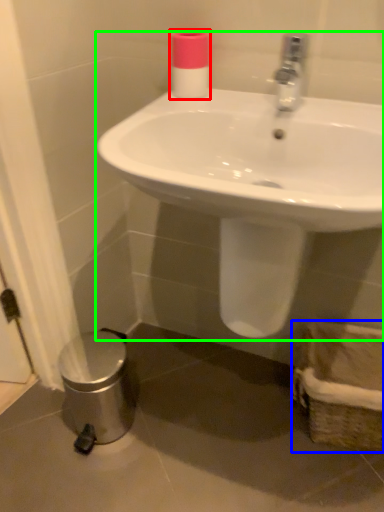
Question: Considering the real-world distances, which object is closest to toiletry (highlighted by a red box)? basket (highlighted by a blue box) or sink (highlighted by a green box).

Choices:
 (A) basket
 (B) sink

Answer: (B)